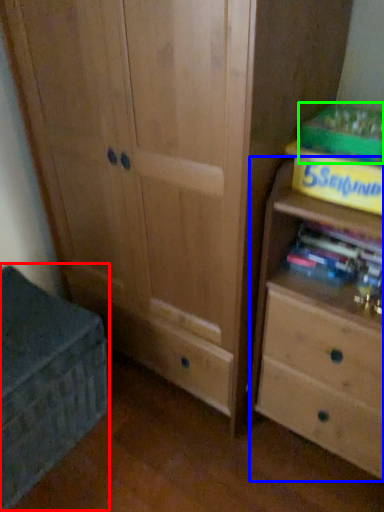
Question: Which object is positioned farthest from cabinetry (highlighted by a red box)? Select from chest of drawers (highlighted by a blue box) and paperback book (highlighted by a green box).

Choices:
 (A) chest of drawers
 (B) paperback book

Answer: (B)